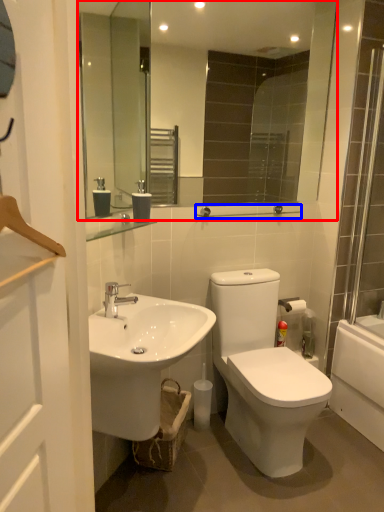
Question: Which of the following is the closest to the observer, mirror (highlighted by a red box) or balustrade (highlighted by a blue box)?

Choices:
 (A) mirror
 (B) balustrade

Answer: (A)